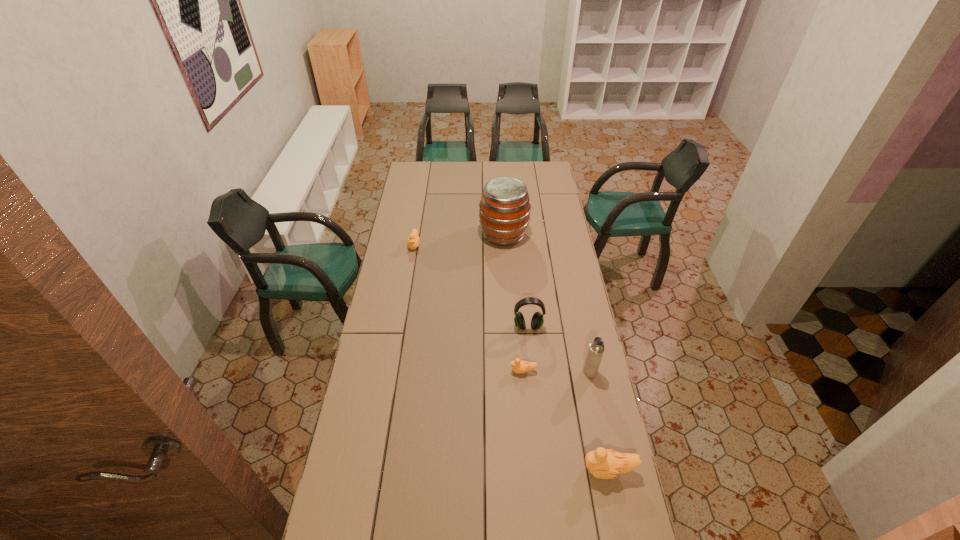
Locate an element on the screen. This screenshot has width=960, height=540. vacant space that's between the second nearest duckling and the cider is located at coordinates (514, 303).

Locate an element on the screen. free space between the second farthest duckling and the fourth shortest object is located at coordinates tap(526, 349).

Identify the location of blank region between the cider and the thermos bottle. Image resolution: width=960 pixels, height=540 pixels. (547, 303).

You are a GUI agent. You are given a task and a screenshot of the screen. Output one action in this format:
    pyautogui.click(x=<x>, y=<y>)
    Task: Click on the free space between the fourth shortest object and the shortest duckling
    This screenshot has width=960, height=540.
    Given the screenshot: What is the action you would take?
    pyautogui.click(x=526, y=349)

Locate an element on the screen. The width and height of the screenshot is (960, 540). free space that is in between the shortest duckling and the second shortest object is located at coordinates (468, 308).

Locate an element on the screen. unoccupied area between the shortest duckling and the cider is located at coordinates (514, 303).

Locate an element on the screen. This screenshot has height=540, width=960. empty space that is in between the nearest duckling and the leftmost object is located at coordinates (512, 357).

Find the location of a particular element. The image size is (960, 540). vacant area that lies between the third farthest object and the thermos bottle is located at coordinates (559, 349).

I want to click on object that stands as the second closest to the nearest object, so click(518, 366).

Where is `object identified as the closest to the third shortest object`? This screenshot has height=540, width=960. object identified as the closest to the third shortest object is located at coordinates (596, 349).